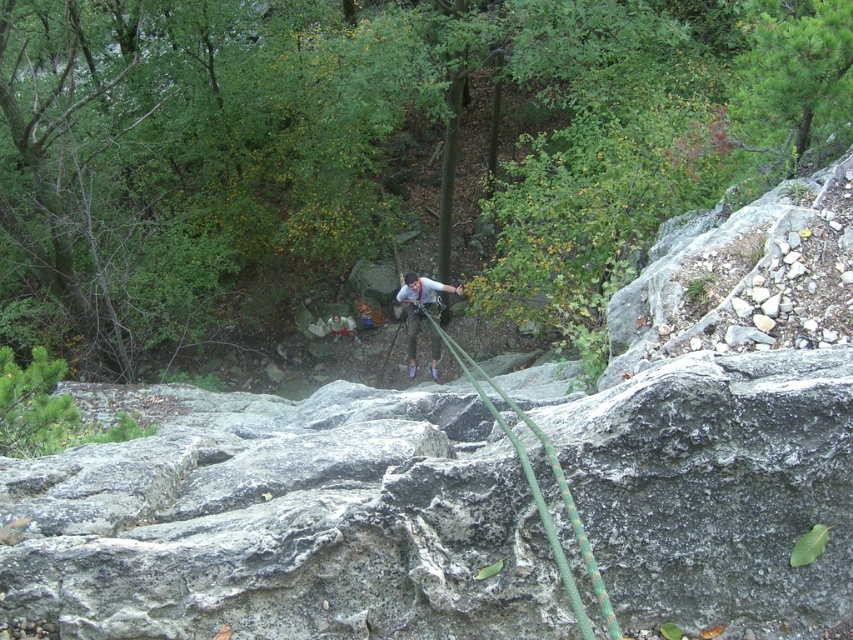
Who is more distant from viewer, (61, 612) or (434, 296)?

The point (434, 296) is behind.

I want to click on gray rough rock at center, so click(281, 522).

Between point (337, 577) and point (409, 310), which one is positioned in front?

Point (337, 577) is in front.

At what (x,y) coordinates should I click in order to perform the action: click on gray rough rock at center. Please return your answer as a coordinate pair (x, y). The width and height of the screenshot is (853, 640). Looking at the image, I should click on (281, 522).